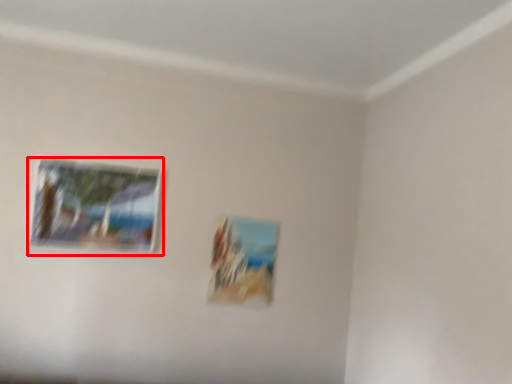
Question: From the image's perspective, what is the correct spatial relationship of picture frame (annotated by the red box) in relation to picture frame?

Choices:
 (A) above
 (B) below

Answer: (A)